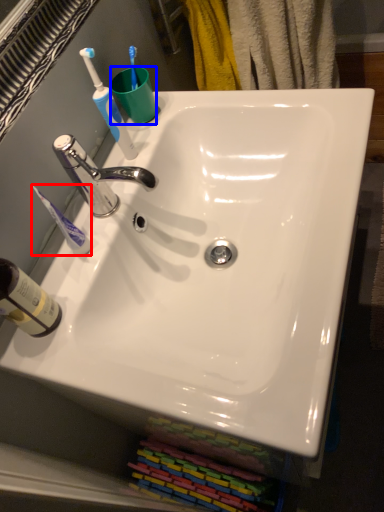
Question: Which point is closer to the camera, toothbrush (highlighted by a red box) or coffee cup (highlighted by a blue box)?

Choices:
 (A) toothbrush
 (B) coffee cup

Answer: (A)